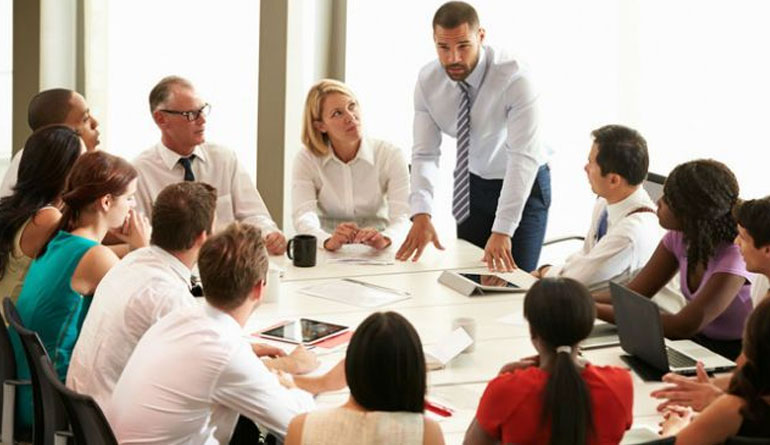
This screenshot has width=770, height=445. I want to click on items on table, so click(x=648, y=355), click(x=493, y=280), click(x=353, y=287), click(x=312, y=247), click(x=360, y=255), click(x=449, y=347), click(x=443, y=408).